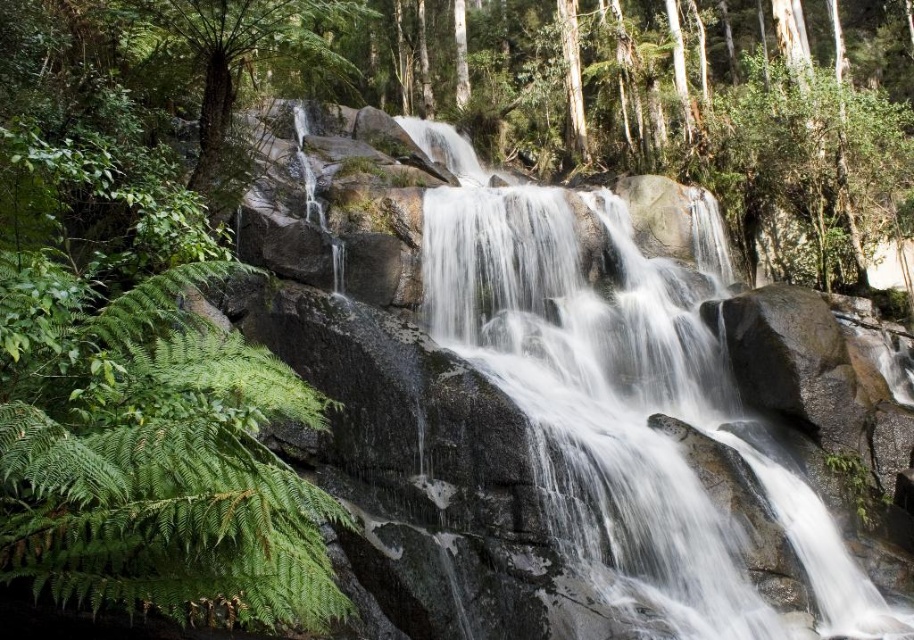
Can you confirm if green leafy fern at left is positioned to the right of green leafy tree at left?

Yes, green leafy fern at left is to the right of green leafy tree at left.

Who is more distant from viewer, [167,339] or [264,51]?

The point [264,51] is more distant.

Does point (120, 444) come closer to viewer compared to point (215, 138)?

Yes, it is in front of point (215, 138).

The width and height of the screenshot is (914, 640). Identify the location of green leafy fern at left. (152, 452).

Does smooth gray rock at center have a lesser width compared to green leafy fern at left?

No.

The width and height of the screenshot is (914, 640). What do you see at coordinates (624, 401) in the screenshot?
I see `smooth gray rock at center` at bounding box center [624, 401].

Describe the element at coordinates (624, 401) in the screenshot. The height and width of the screenshot is (640, 914). I see `smooth gray rock at center` at that location.

Image resolution: width=914 pixels, height=640 pixels. What are the coordinates of `smooth gray rock at center` in the screenshot? It's located at pos(624,401).

Is the position of smooth gray rock at center more distant than that of green leafy tree at left?

Yes, smooth gray rock at center is behind green leafy tree at left.

Does smooth gray rock at center appear on the right side of green leafy tree at left?

Indeed, smooth gray rock at center is positioned on the right side of green leafy tree at left.

Measure the distance between smooth gray rock at center and camera.

smooth gray rock at center and camera are 12.19 meters apart.

In order to click on smooth gray rock at center in this screenshot , I will do `click(624, 401)`.